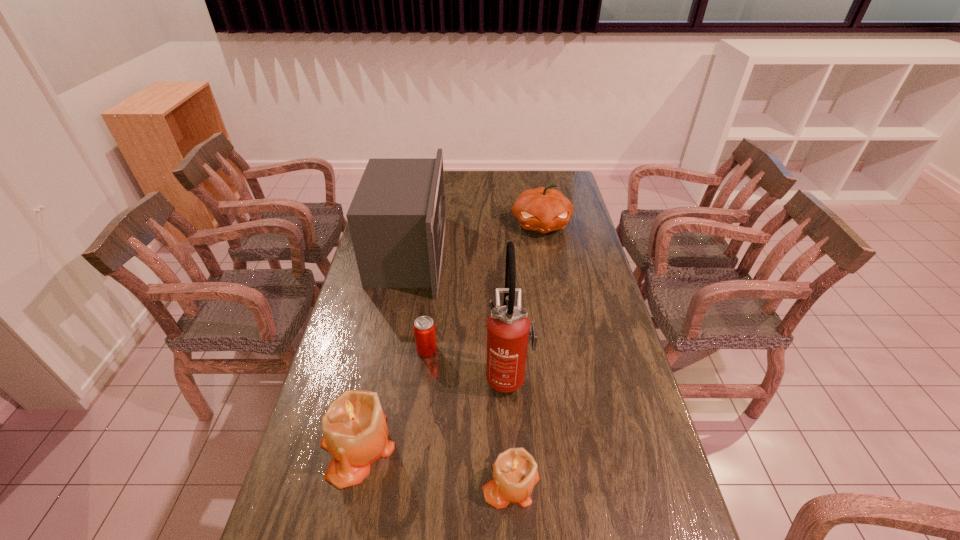
Select which object appears as the second closest to the tallest object. Please provide its 2D coordinates. Your answer should be formatted as a tuple, i.e. [(x, y)], where the tuple contains the x and y coordinates of a point satisfying the conditions above.

[(515, 473)]

Locate which object ranks in proximity to the second tallest object. Please provide its 2D coordinates. Your answer should be formatted as a tuple, i.e. [(x, y)], where the tuple contains the x and y coordinates of a point satisfying the conditions above.

[(424, 328)]

Identify the location of blank space that satisfies the following two spatial constraints: 1. on the back side of the can; 2. on the front-facing side of the microwave oven. The image size is (960, 540). (438, 254).

Find the location of `free space that satisfies the following two spatial constraints: 1. on the front-facing side of the can; 2. on the left side of the microwave oven`. free space that satisfies the following two spatial constraints: 1. on the front-facing side of the can; 2. on the left side of the microwave oven is located at coordinates (390, 350).

Identify the location of blank area in the image that satisfies the following two spatial constraints: 1. on the front face of the pumpkin; 2. on the front-facing side of the fifth shortest object. (546, 254).

The image size is (960, 540). In order to click on vacant space that satisfies the following two spatial constraints: 1. on the front side of the can; 2. on the left side of the shorter candle in this screenshot , I will do `click(412, 483)`.